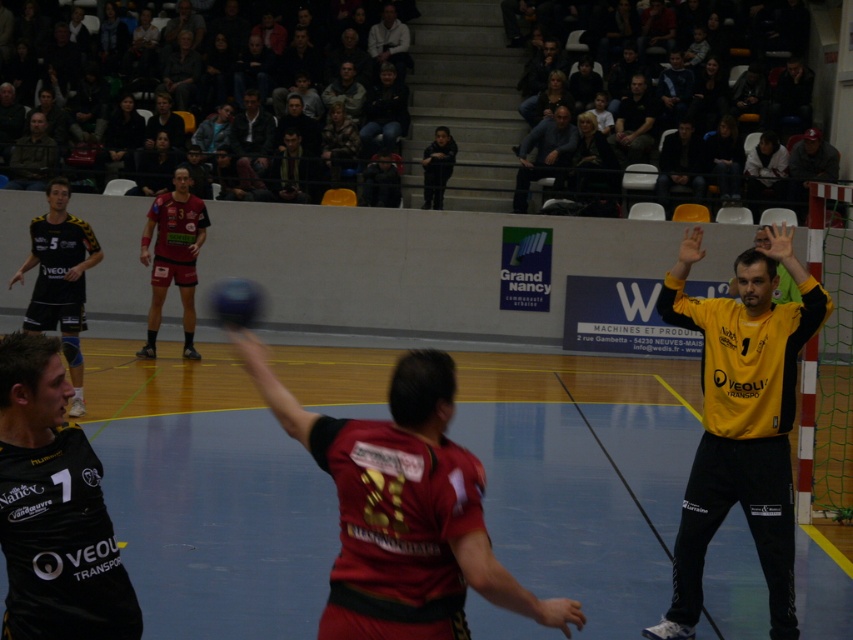
Does dark blue jeans at center have a lesser height compared to light gray sweater at upper center?

No.

Can you confirm if dark blue jeans at center is wider than light gray sweater at upper center?

Correct, the width of dark blue jeans at center exceeds that of light gray sweater at upper center.

Is point (527, 161) positioned after point (403, 76)?

No, it is in front of (403, 76).

You are a GUI agent. You are given a task and a screenshot of the screen. Output one action in this format:
    pyautogui.click(x=<x>, y=<y>)
    Task: Click on the dark blue jeans at center
    The height and width of the screenshot is (640, 853).
    Given the screenshot: What is the action you would take?
    pyautogui.click(x=544, y=154)

Between dark blue jeans at center and camouflage jacket at upper left, which one is positioned higher?

Positioned higher is camouflage jacket at upper left.

Is point (554, 177) in front of point (26, 166)?

Yes, it is.

Which is behind, point (572, 125) or point (32, 156)?

Point (32, 156)

Where is `dark blue jeans at center`? dark blue jeans at center is located at coordinates pos(544,154).

Who is lower down, yellow jersey at right or blue rubber volleyball at center?

yellow jersey at right

Does yellow jersey at right have a lesser height compared to blue rubber volleyball at center?

In fact, yellow jersey at right may be taller than blue rubber volleyball at center.

This screenshot has height=640, width=853. I want to click on yellow jersey at right, so click(x=741, y=420).